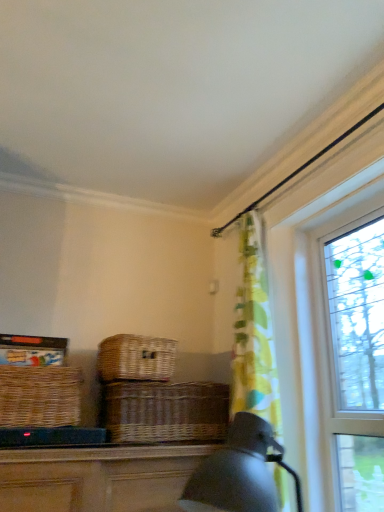
In order to click on free space above clear glass window at right (from a real-world perspective) in this screenshot , I will do `click(332, 207)`.